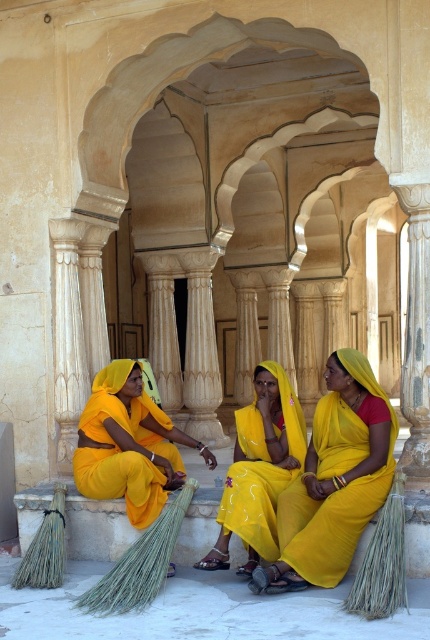
Measure the distance from yellow silk saree at center to matte yellow sari at lower left.

A distance of 1.99 meters exists between yellow silk saree at center and matte yellow sari at lower left.

Does yellow silk saree at center lie in front of matte yellow sari at lower left?

Yes, it is.

Does point (278, 532) lie in front of point (174, 452)?

That is True.

Locate an element on the screen. This screenshot has height=640, width=430. yellow silk saree at center is located at coordinates (334, 480).

Is yellow satin saree at center wider than matte yellow sari at lower left?

Incorrect, yellow satin saree at center's width does not surpass matte yellow sari at lower left's.

Which is behind, point (218, 522) or point (128, 433)?

The point (128, 433) is more distant.

Does point (251, 442) come behind point (76, 468)?

No, (251, 442) is in front of (76, 468).

Locate an element on the screen. Image resolution: width=430 pixels, height=640 pixels. yellow satin saree at center is located at coordinates (258, 468).

Which of these two, yellow silk saree at center or yellow satin saree at center, stands shorter?

Answer: yellow satin saree at center is shorter.

Is point (283, 570) less distant than point (255, 515)?

Yes.

At what (x,y) coordinates should I click in order to perform the action: click on yellow silk saree at center. Please return your answer as a coordinate pair (x, y). This screenshot has width=430, height=640. Looking at the image, I should click on (334, 480).